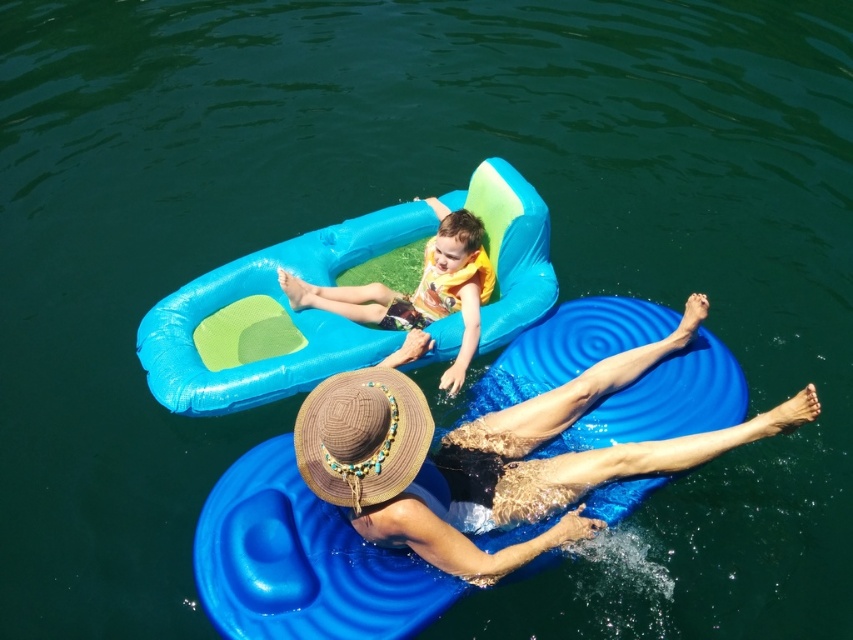
Question: Does straw hat at lower center lie in front of matte yellow life vest at center?

Choices:
 (A) no
 (B) yes

Answer: (B)

Question: Does straw hat at lower center have a lesser width compared to blue inflatable boat at upper center?

Choices:
 (A) no
 (B) yes

Answer: (B)

Question: Which of the following is the closest to the observer?

Choices:
 (A) blue inflatable boat at upper center
 (B) matte yellow life vest at center
 (C) straw hat at lower center

Answer: (C)

Question: Is straw hat at lower center smaller than blue inflatable boat at upper center?

Choices:
 (A) no
 (B) yes

Answer: (B)

Question: Which object is closer to the camera taking this photo?

Choices:
 (A) matte yellow life vest at center
 (B) straw hat at lower center

Answer: (B)

Question: Which of these objects is positioned closest to the straw hat at lower center?

Choices:
 (A) blue inflatable boat at upper center
 (B) matte yellow life vest at center

Answer: (B)